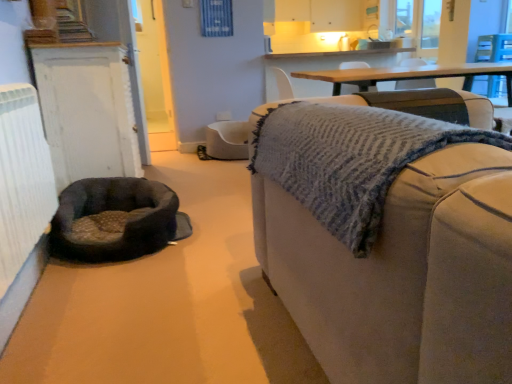
In order to face soft gray fabric dog bed at lower left, should I rotate leftwards or rightwards?

You should look left and rotate roughly 18.234 degrees.

Describe the element at coordinates (87, 111) in the screenshot. The width and height of the screenshot is (512, 384). I see `white painted wood door at left` at that location.

The height and width of the screenshot is (384, 512). What do you see at coordinates (403, 274) in the screenshot?
I see `beige fabric couch at right` at bounding box center [403, 274].

Identify the location of soft gray fabric dog bed at lower left. The height and width of the screenshot is (384, 512). (115, 220).

Is there a large distance between white painted wood door at left and soft gray fabric dog bed at lower left?

white painted wood door at left is actually quite close to soft gray fabric dog bed at lower left.

Which of these two, white painted wood door at left or soft gray fabric dog bed at lower left, is thinner?

white painted wood door at left is thinner.

Could you tell me if white painted wood door at left is facing soft gray fabric dog bed at lower left?

No.

Which object is positioned more to the right, white painted wood door at left or soft gray fabric dog bed at lower left?

soft gray fabric dog bed at lower left.

Between point (114, 225) and point (49, 183), which one is positioned behind?

The point (114, 225) is behind.

Can white textured radiator at left be found inside soft gray fabric dog bed at lower left?

That's incorrect, white textured radiator at left is not inside soft gray fabric dog bed at lower left.

Is beige fabric couch at right next to white painted wood door at left and touching it?

There is a gap between beige fabric couch at right and white painted wood door at left.

Does beige fabric couch at right appear on the left side of white painted wood door at left?

In fact, beige fabric couch at right is to the right of white painted wood door at left.

Is beige fabric couch at right shorter than white painted wood door at left?

Yes, beige fabric couch at right is shorter than white painted wood door at left.

Is beige fabric couch at right positioned beyond the bounds of white painted wood door at left?

Yes, beige fabric couch at right is not within white painted wood door at left.

Considering the relative sizes of white textured radiator at left and white painted wood door at left in the image provided, is white textured radiator at left taller than white painted wood door at left?

No.

Which object is further away from the camera, white textured radiator at left or white painted wood door at left?

white painted wood door at left is further from the camera.

Which object is positioned more to the right, white textured radiator at left or white painted wood door at left?

From the viewer's perspective, white textured radiator at left appears more on the right side.

Between white painted wood door at left and beige fabric couch at right, which one appears on the left side from the viewer's perspective?

From the viewer's perspective, white painted wood door at left appears more on the left side.

Where is `cabinetry above the beige fabric couch at right (from a real-world perspective)`? This screenshot has height=384, width=512. cabinetry above the beige fabric couch at right (from a real-world perspective) is located at coordinates (87, 111).

From a real-world perspective, is white painted wood door at left above or below beige fabric couch at right?

white painted wood door at left is situated higher than beige fabric couch at right in the real world.

Is white painted wood door at left located outside beige fabric couch at right?

That's correct, white painted wood door at left is outside of beige fabric couch at right.

The height and width of the screenshot is (384, 512). I want to click on studio couch positioned vertically above the soft gray fabric dog bed at lower left (from a real-world perspective), so [403, 274].

Is beige fabric couch at right surrounded by soft gray fabric dog bed at lower left?

No, beige fabric couch at right is located outside of soft gray fabric dog bed at lower left.

From a real-world perspective, is soft gray fabric dog bed at lower left positioned above or below beige fabric couch at right?

soft gray fabric dog bed at lower left is below beige fabric couch at right.

Considering the positions of point (176, 228) and point (508, 197), is point (176, 228) closer or farther from the camera than point (508, 197)?

Point (176, 228).

Would you say beige fabric couch at right is to the left or to the right of soft gray fabric dog bed at lower left in the picture?

From the image, it's evident that beige fabric couch at right is to the right of soft gray fabric dog bed at lower left.

Could you tell me if beige fabric couch at right is turned towards soft gray fabric dog bed at lower left?

No, beige fabric couch at right is not aimed at soft gray fabric dog bed at lower left.

Who is shorter, beige fabric couch at right or soft gray fabric dog bed at lower left?

soft gray fabric dog bed at lower left is shorter.

Is beige fabric couch at right completely or partially outside of soft gray fabric dog bed at lower left?

Yes, beige fabric couch at right is not within soft gray fabric dog bed at lower left.

You are a GUI agent. You are given a task and a screenshot of the screen. Output one action in this format:
    pyautogui.click(x=<x>, y=<y>)
    Task: Click on the cabinetry above the soft gray fabric dog bed at lower left (from a real-world perspective)
    The height and width of the screenshot is (384, 512).
    Given the screenshot: What is the action you would take?
    pyautogui.click(x=87, y=111)

Where is `dog bed located underneath the white textured radiator at left (from a real-world perspective)`? dog bed located underneath the white textured radiator at left (from a real-world perspective) is located at coordinates (115, 220).

Consider the image. Considering their positions, is white painted wood door at left positioned closer to white textured radiator at left than soft gray fabric dog bed at lower left?

Among the two, soft gray fabric dog bed at lower left is located nearer to white textured radiator at left.

When comparing their distances from soft gray fabric dog bed at lower left, does white painted wood door at left or beige fabric couch at right seem closer?

white painted wood door at left is closer to soft gray fabric dog bed at lower left.

Considering their positions, is soft gray fabric dog bed at lower left positioned further to white textured radiator at left than beige fabric couch at right?

beige fabric couch at right is further to white textured radiator at left.

Considering their positions, is soft gray fabric dog bed at lower left positioned further to white painted wood door at left than beige fabric couch at right?

beige fabric couch at right lies further to white painted wood door at left than the other object.

From the picture: Based on their spatial positions, is white textured radiator at left or soft gray fabric dog bed at lower left closer to white painted wood door at left?

soft gray fabric dog bed at lower left is positioned closer to the anchor white painted wood door at left.

Considering their positions, is white painted wood door at left positioned further to white textured radiator at left than beige fabric couch at right?

beige fabric couch at right is further to white textured radiator at left.

From the image, which object appears to be nearer to white textured radiator at left, soft gray fabric dog bed at lower left or white painted wood door at left?

Based on the image, soft gray fabric dog bed at lower left appears to be nearer to white textured radiator at left.

When comparing their distances from beige fabric couch at right, does white textured radiator at left or white painted wood door at left seem further?

Based on the image, white painted wood door at left appears to be further to beige fabric couch at right.

The height and width of the screenshot is (384, 512). Find the location of `radiator between beige fabric couch at right and white painted wood door at left along the z-axis`. radiator between beige fabric couch at right and white painted wood door at left along the z-axis is located at coordinates coord(22,179).

Locate an element on the screen. dog bed between white textured radiator at left and beige fabric couch at right from left to right is located at coordinates (115, 220).

Where is `dog bed located between white textured radiator at left and white painted wood door at left in the depth direction`? This screenshot has width=512, height=384. dog bed located between white textured radiator at left and white painted wood door at left in the depth direction is located at coordinates (115, 220).

Where is `dog bed located between beige fabric couch at right and white painted wood door at left in the depth direction`? This screenshot has height=384, width=512. dog bed located between beige fabric couch at right and white painted wood door at left in the depth direction is located at coordinates (115, 220).